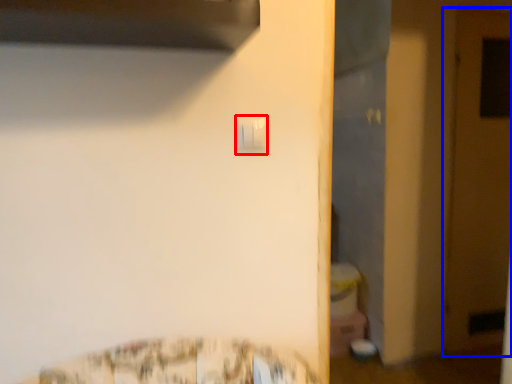
Question: Among these objects, which one is nearest to the camera, light switch (highlighted by a red box) or door (highlighted by a blue box)?

Choices:
 (A) light switch
 (B) door

Answer: (A)